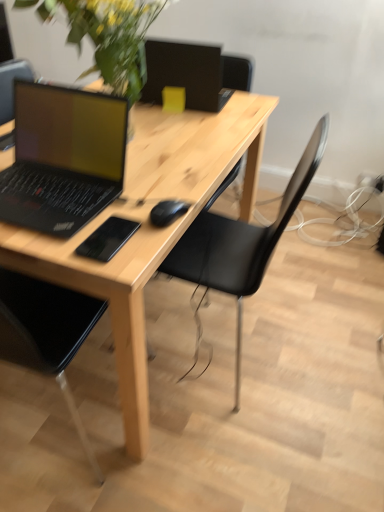
Identify the location of free point behind black matte mousepad at center. The width and height of the screenshot is (384, 512). (140, 195).